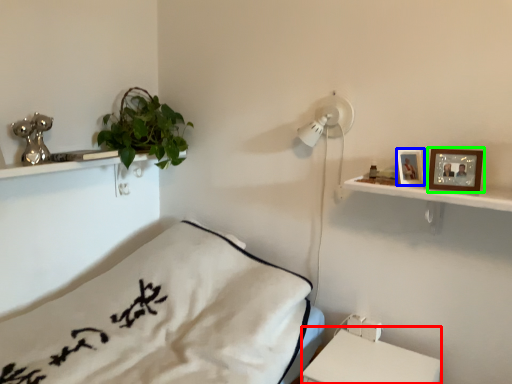
Question: Considering the real-world distances, which object is closest to table (highlighted by a red box)? picture frame (highlighted by a blue box) or picture frame (highlighted by a green box).

Choices:
 (A) picture frame
 (B) picture frame

Answer: (A)